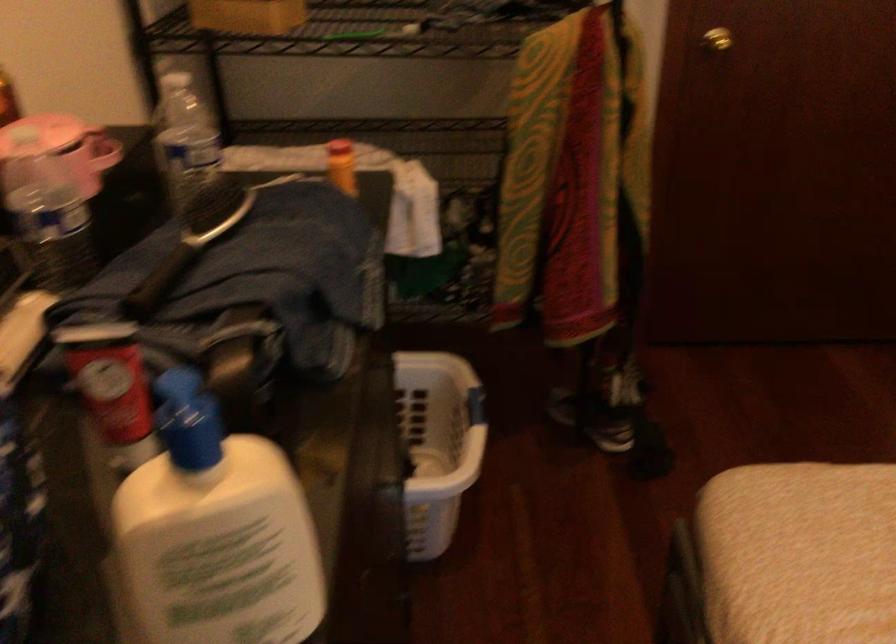
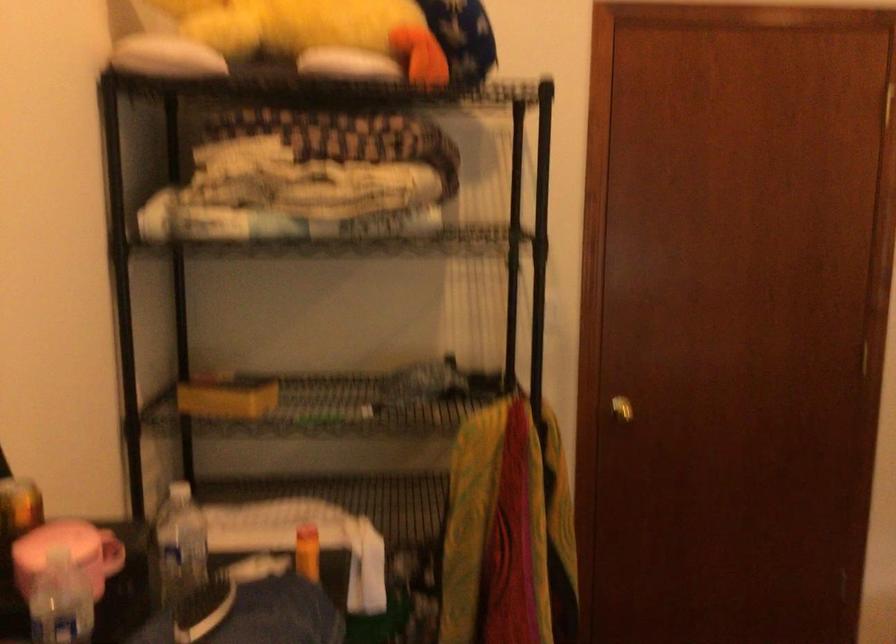
Question: What movement of the cameraman would produce the second image?

Choices:
 (A) Left
 (B) Right
 (C) Forward
 (D) Backward

Answer: (D)